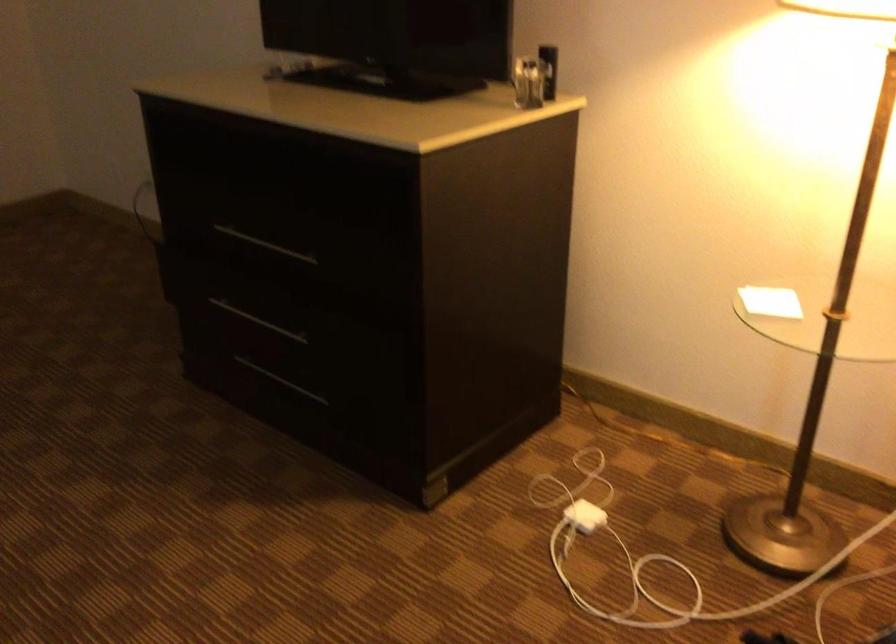
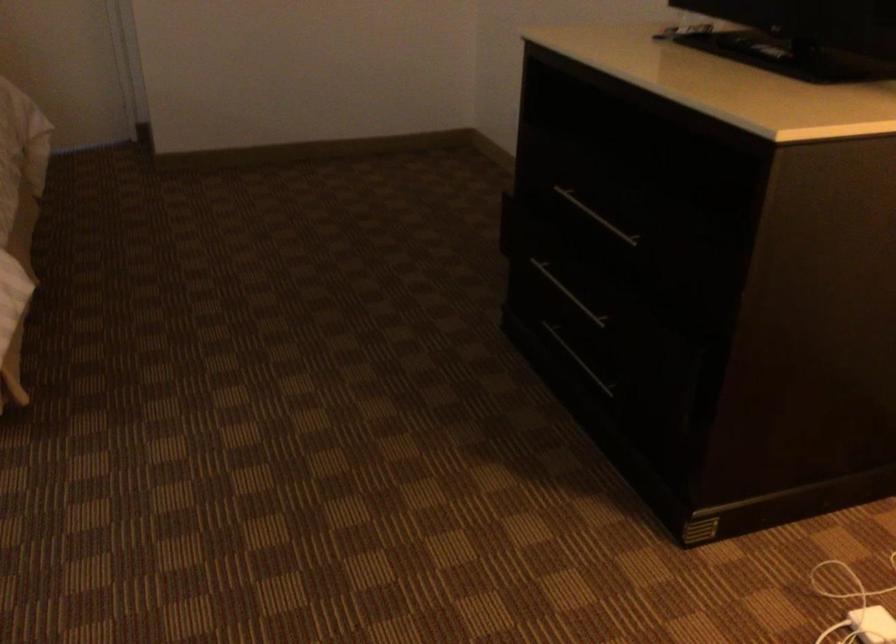
Question: The camera is either moving clockwise (left) or counter-clockwise (right) around the object. The first image is from the beginning of the video and the second image is from the end. Is the camera moving left or right when shooting the video?

Choices:
 (A) Left
 (B) Right

Answer: (B)